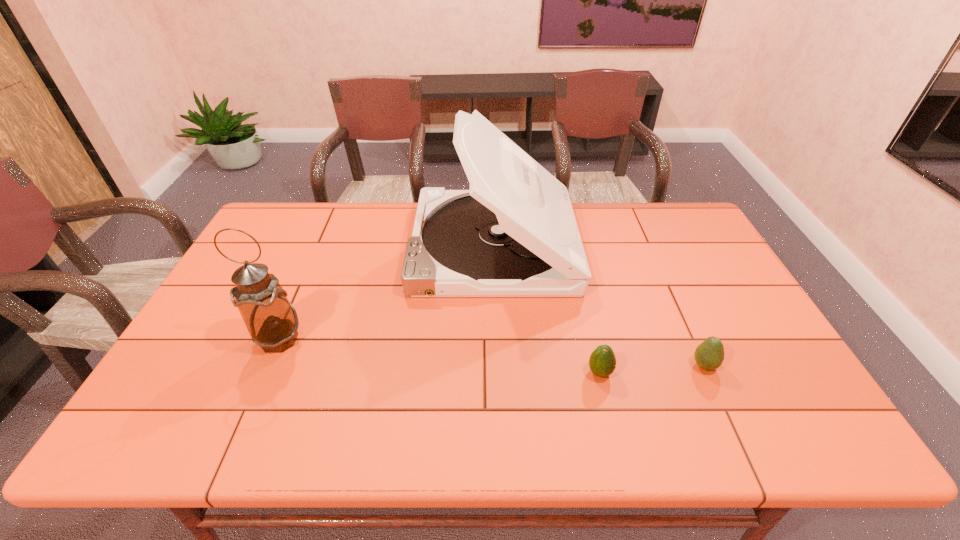
In order to click on vacant area that satisfies the following two spatial constraints: 1. on the front side of the left avocado; 2. on the left side of the leftmost object in this screenshot , I will do `click(265, 373)`.

Locate an element on the screen. vacant space that satisfies the following two spatial constraints: 1. on the control panel of the farthest object; 2. on the right side of the left avocado is located at coordinates (497, 373).

Where is `free space that satisfies the following two spatial constraints: 1. on the back side of the rightmost object; 2. on the control panel of the farthest object`? free space that satisfies the following two spatial constraints: 1. on the back side of the rightmost object; 2. on the control panel of the farthest object is located at coordinates (x=649, y=246).

Identify the location of free space that satisfies the following two spatial constraints: 1. on the front side of the left avocado; 2. on the right side of the oil lamp. (265, 373).

The image size is (960, 540). Find the location of `blank area in the image that satisfies the following two spatial constraints: 1. on the control panel of the farthest object; 2. on the back side of the left avocado`. blank area in the image that satisfies the following two spatial constraints: 1. on the control panel of the farthest object; 2. on the back side of the left avocado is located at coordinates (497, 373).